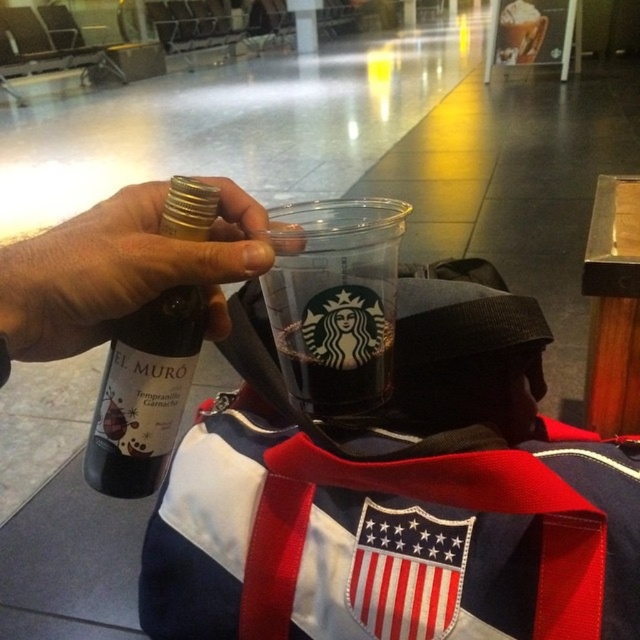
Is red and white canvas bag at center thinner than matte black bottle at upper left?

In fact, red and white canvas bag at center might be wider than matte black bottle at upper left.

Who is more forward, (464, 598) or (241, 230)?

Point (464, 598) is more forward.

Who is more distant from viewer, (424, 396) or (97, 218)?

Positioned behind is point (424, 396).

This screenshot has height=640, width=640. What are the coordinates of `red and white canvas bag at center` in the screenshot? It's located at (401, 504).

Is matte black bottle at upper left to the right of transparent plastic cup at center from the viewer's perspective?

No, matte black bottle at upper left is not to the right of transparent plastic cup at center.

Is matte black bottle at upper left below transparent plastic cup at center?

No, matte black bottle at upper left is not below transparent plastic cup at center.

Is point (84, 316) positioned after point (360, 268)?

No, (84, 316) is closer to viewer.

Identify the location of matte black bottle at upper left. The height and width of the screenshot is (640, 640). (122, 269).

Is red and white canvas bag at center wider than matte glass bottle at upper left?

Yes, red and white canvas bag at center is wider than matte glass bottle at upper left.

Is point (570, 525) more distant than point (147, 492)?

Yes, it is behind point (147, 492).

You are a GUI agent. You are given a task and a screenshot of the screen. Output one action in this format:
    pyautogui.click(x=<x>, y=<y>)
    Task: Click on the red and white canvas bag at center
    This screenshot has width=640, height=640.
    Given the screenshot: What is the action you would take?
    pyautogui.click(x=401, y=504)

Locate an element on the screen. red and white canvas bag at center is located at coordinates (401, 504).